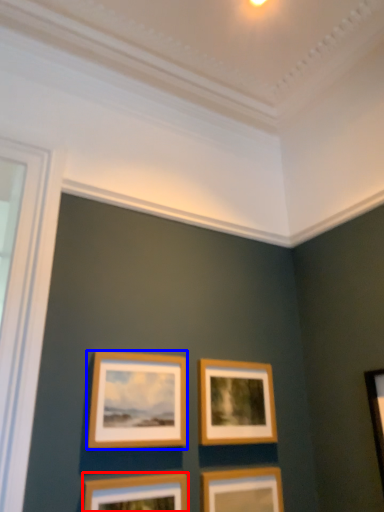
Question: Which object is further to the camera taking this photo, picture frame (highlighted by a red box) or picture frame (highlighted by a blue box)?

Choices:
 (A) picture frame
 (B) picture frame

Answer: (B)